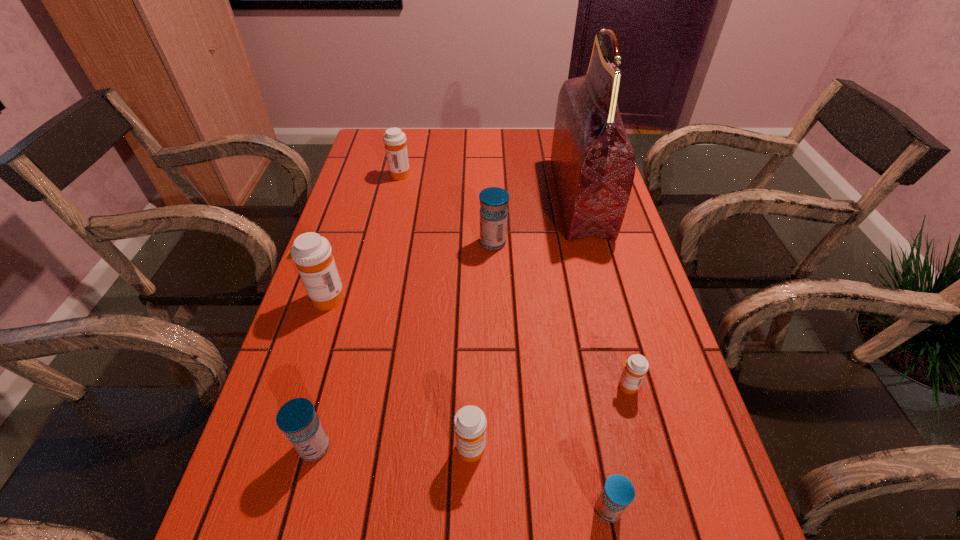
You are a GUI agent. You are given a task and a screenshot of the screen. Output one action in this format:
    pyautogui.click(x=<x>, y=<y>)
    Task: Click on the second smallest blue medicine
    
    Given the screenshot: What is the action you would take?
    pyautogui.click(x=297, y=418)

I want to click on the smallest orange medicine, so click(636, 366).

Where is `the rightmost medicine`? the rightmost medicine is located at coordinates (636, 366).

Locate an element on the screen. This screenshot has width=960, height=540. the second medicine from right to left is located at coordinates (618, 492).

You are a GUI agent. You are given a task and a screenshot of the screen. Output one action in this format:
    pyautogui.click(x=<x>, y=<y>)
    Task: Click on the nearest object
    
    Given the screenshot: What is the action you would take?
    pyautogui.click(x=618, y=492)

Find the location of `vacant space located 0.300m on the front-facing side of the handbag`. vacant space located 0.300m on the front-facing side of the handbag is located at coordinates (457, 197).

Locate an element on the screen. Image resolution: width=960 pixels, height=540 pixels. free space located on the front-facing side of the handbag is located at coordinates (514, 197).

You are a GUI agent. You are given a task and a screenshot of the screen. Output one action in this format:
    pyautogui.click(x=<x>, y=<y>)
    Task: Click on the vacant space located 0.080m on the front-facing side of the handbag
    
    Given the screenshot: What is the action you would take?
    pyautogui.click(x=531, y=197)

Find the location of `vacant region located on the front of the fourth farthest object`. vacant region located on the front of the fourth farthest object is located at coordinates (298, 386).

Identify the location of vacant space located 0.150m on the back of the farthest medicine. The height and width of the screenshot is (540, 960). (406, 144).